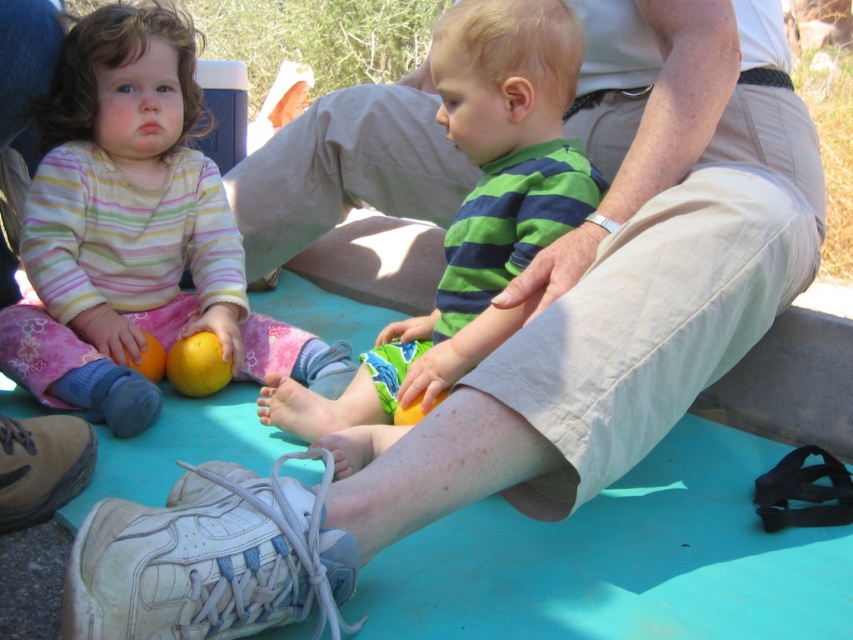
Question: Estimate the real-world distances between objects in this image. Which object is farther from the yellow matte orange at center?

Choices:
 (A) matte yellow citrus fruit at lower left
 (B) green striped shirt at center
 (C) orange matte at lower left

Answer: (B)

Question: Is matte yellow citrus fruit at lower left thinner than yellow matte orange at center?

Choices:
 (A) yes
 (B) no

Answer: (B)

Question: Which of the following is the closest to the observer?

Choices:
 (A) yellow matte orange at center
 (B) matte yellow citrus fruit at lower left

Answer: (B)

Question: Does green striped shirt at center have a greater width compared to yellow matte orange at center?

Choices:
 (A) yes
 (B) no

Answer: (A)

Question: In this image, where is green striped shirt at center located relative to yellow matte orange at center?

Choices:
 (A) right
 (B) left

Answer: (A)

Question: Among these points, which one is farthest from the camera?

Choices:
 (A) (170, 371)
 (B) (144, 362)
 (C) (532, 22)
 (D) (35, 394)

Answer: (A)